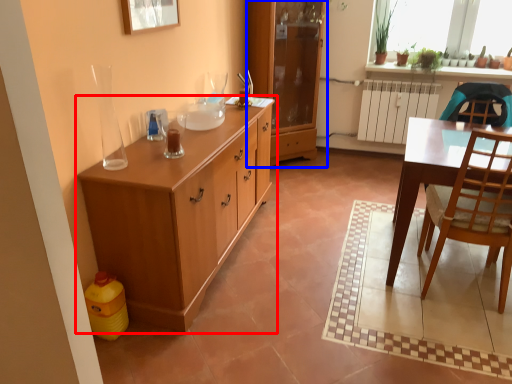
Question: Which object is further to the camera taking this photo, cabinetry (highlighted by a red box) or cabinetry (highlighted by a blue box)?

Choices:
 (A) cabinetry
 (B) cabinetry

Answer: (B)